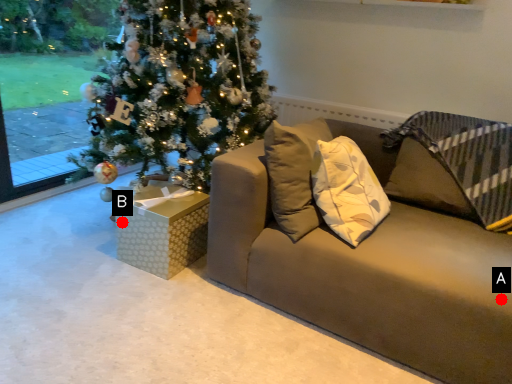
Question: Two points are circled on the image, labeled by A and B beside each circle. Which of the following is the farthest from the observer?

Choices:
 (A) A is further
 (B) B is further

Answer: (B)